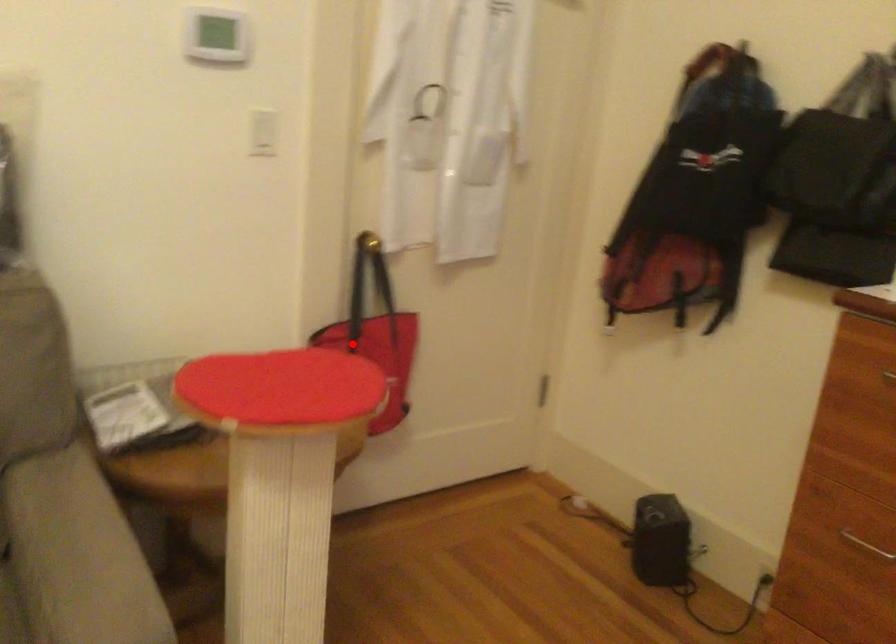
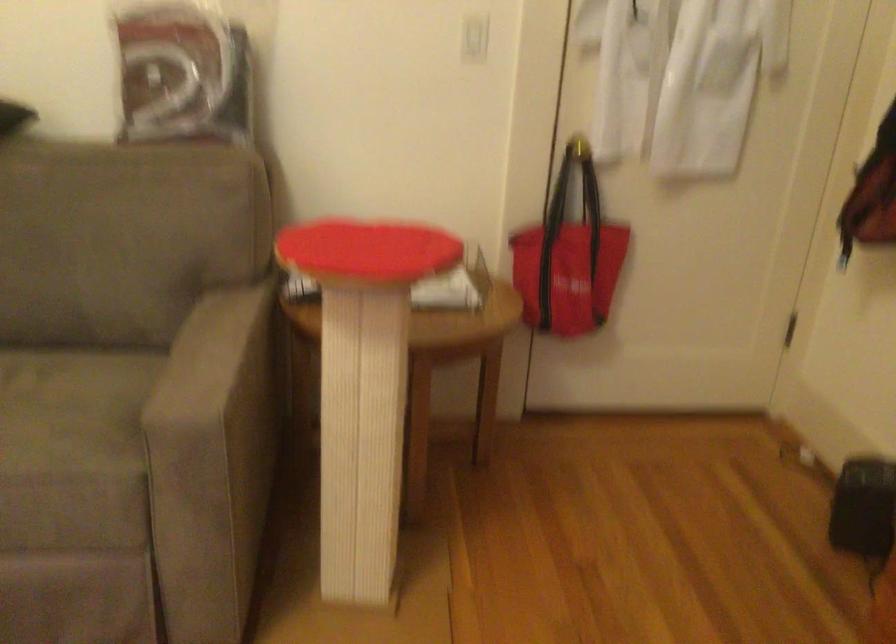
Where in the second image is the point corresponding to the highlighted location from the first image?

(550, 245)